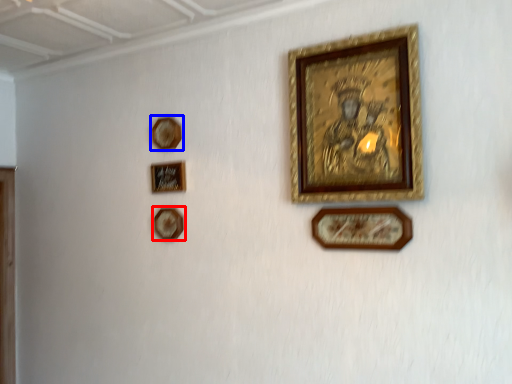
Question: Which object is further to the camera taking this photo, picture frame (highlighted by a red box) or picture frame (highlighted by a blue box)?

Choices:
 (A) picture frame
 (B) picture frame

Answer: (A)